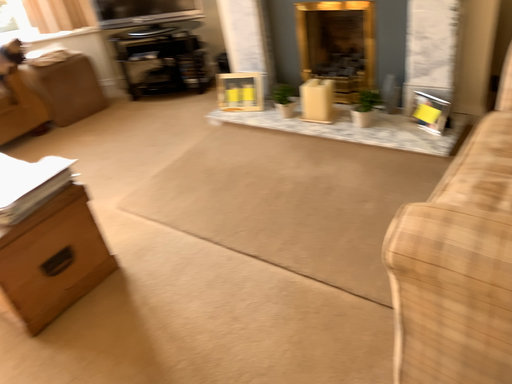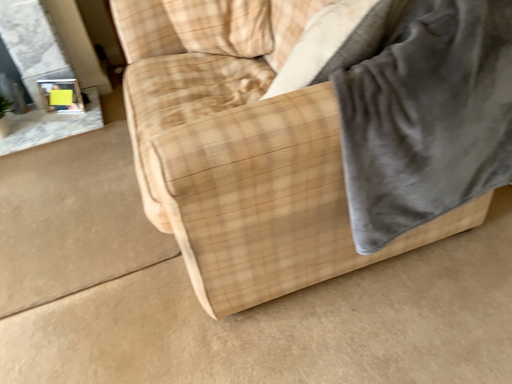
Question: How did the camera likely rotate when shooting the video?

Choices:
 (A) rotated upward
 (B) rotated downward

Answer: (A)